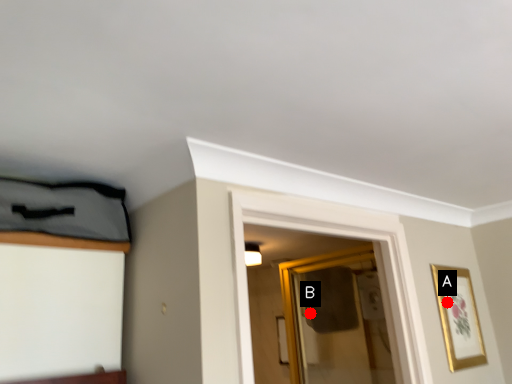
Question: Two points are circled on the image, labeled by A and B beside each circle. Which point is farther to the camera?

Choices:
 (A) A is further
 (B) B is further

Answer: (B)